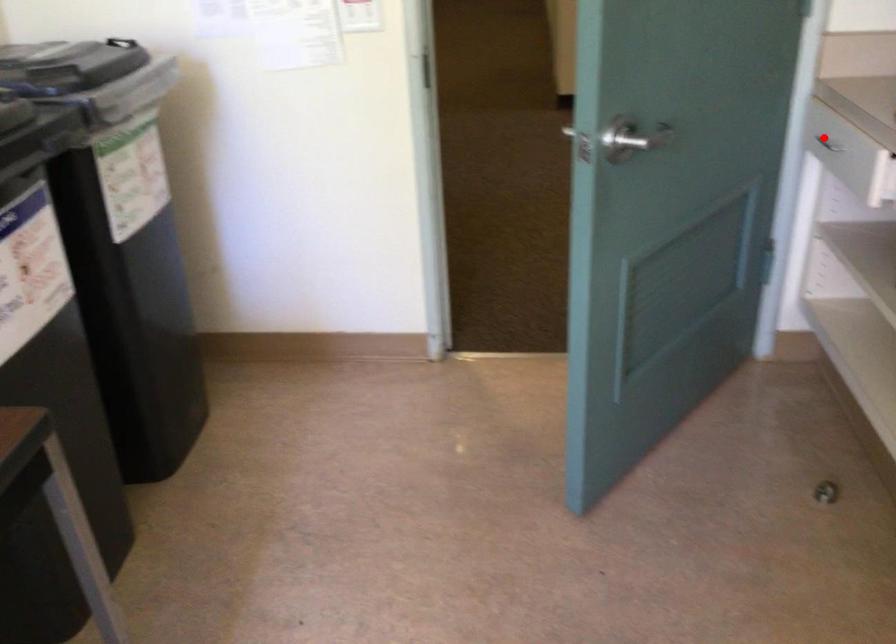
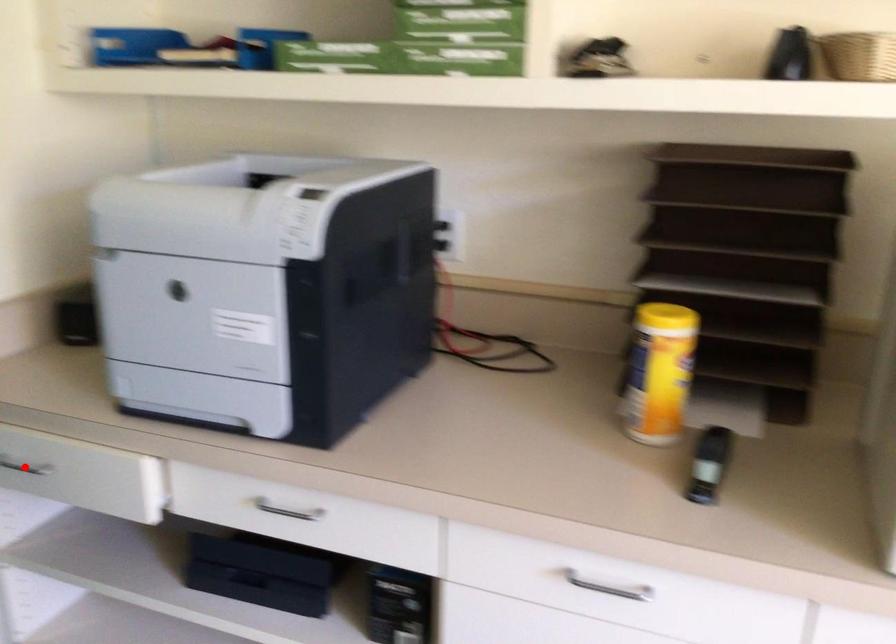
I am providing you with two images of the same scene from different viewpoints. A red point is marked on the first image and another point is marked on the second image. Does the point marked in image1 correspond to the same location as the one in image2?

Yes